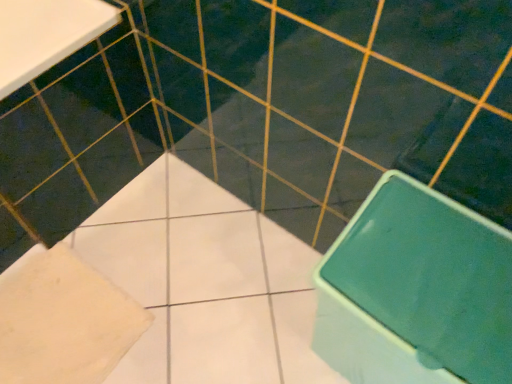
At what (x,y) coordinates should I click in order to perform the action: click on free space above teal glossy toilet at lower right (from a real-world perspective). Please return your answer as a coordinate pair (x, y). Looking at the image, I should click on (438, 273).